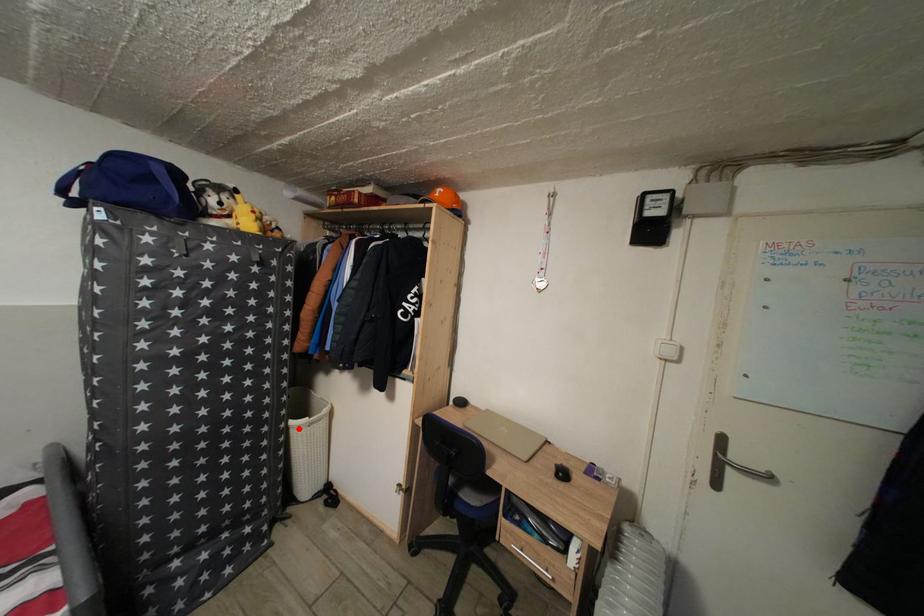
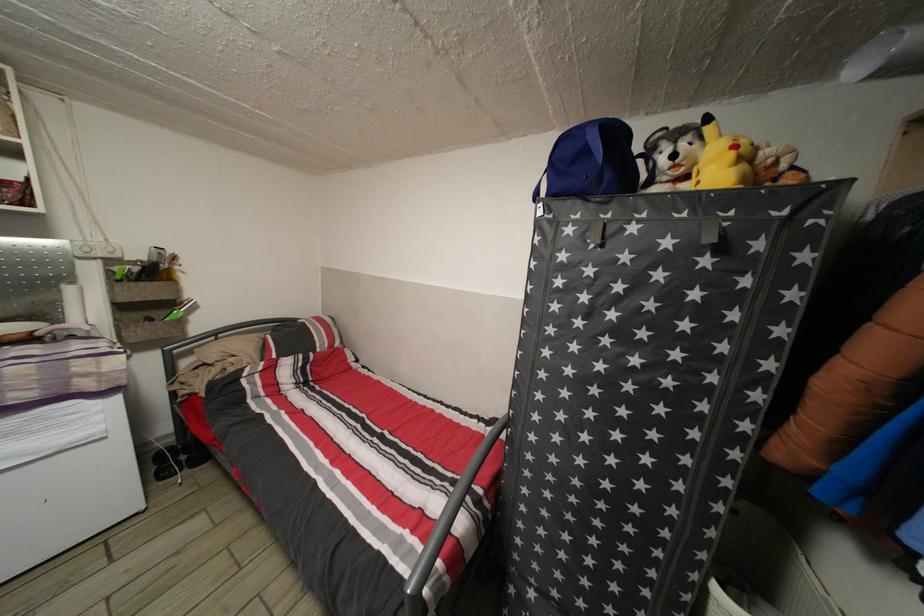
In the second image, find the point that corresponds to the highlighted location in the first image.

(723, 594)